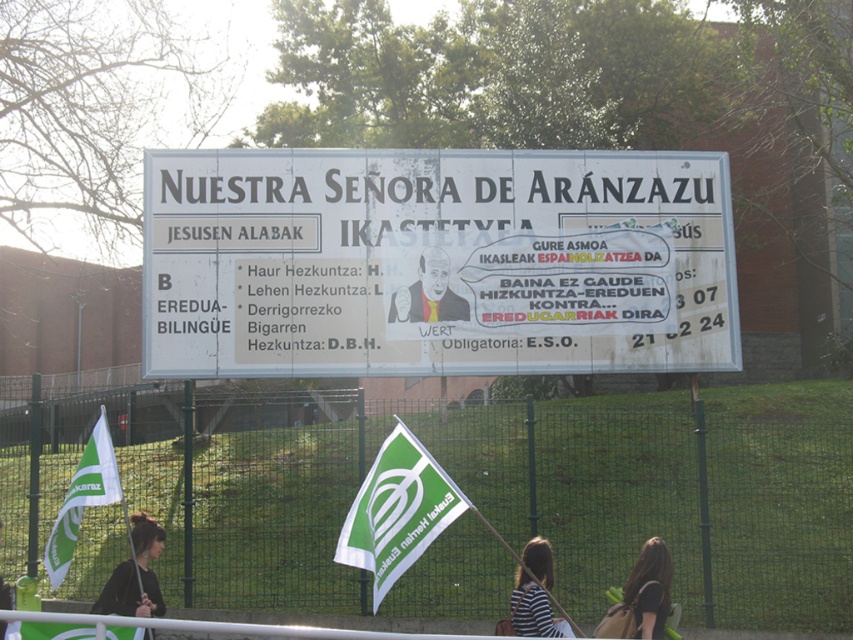
Question: Which object appears closest to the camera in this image?

Choices:
 (A) white paper sign at center
 (B) green fabric flag at lower center
 (C) cartoon figure at center

Answer: (B)

Question: Which point is closer to the camera?

Choices:
 (A) (97, 420)
 (B) (657, 548)
 (C) (546, 198)
 (D) (108, 595)

Answer: (B)

Question: Can you confirm if green fabric flag at lower left is bigger than cartoon figure at center?

Choices:
 (A) yes
 (B) no

Answer: (A)

Question: Among these objects, which one is farthest from the camera?

Choices:
 (A) cartoon figure at center
 (B) green fabric flag at lower center
 (C) green fabric flag at lower left

Answer: (A)

Question: From the image, what is the correct spatial relationship of cartoon figure at center in relation to dark brown hair at center?

Choices:
 (A) right
 (B) left

Answer: (B)

Question: Does cartoon figure at center appear on the right side of striped fabric shirt at center?

Choices:
 (A) no
 (B) yes

Answer: (A)